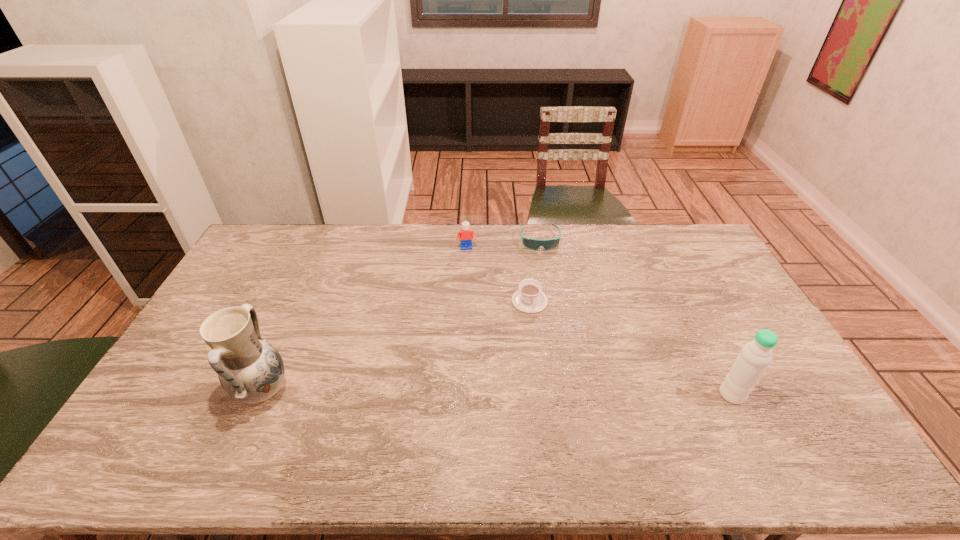
This screenshot has width=960, height=540. I want to click on pottery that is at the near edge, so click(250, 370).

Identify the location of water bottle that is at the near edge. (751, 363).

In the image, there is a desktop. What are the coordinates of `vacant area at the far edge` in the screenshot? It's located at (344, 256).

The height and width of the screenshot is (540, 960). In the image, there is a desktop. Identify the location of free space at the near edge. (263, 427).

You are a GUI agent. You are given a task and a screenshot of the screen. Output one action in this format:
    pyautogui.click(x=<x>, y=<y>)
    Task: Click on the free space at the left edge of the desktop
    Image resolution: width=960 pixels, height=540 pixels.
    Given the screenshot: What is the action you would take?
    pyautogui.click(x=262, y=285)

Find the location of a particular element. Image resolution: width=960 pixels, height=540 pixels. free point at the right edge is located at coordinates pyautogui.click(x=723, y=272).

The width and height of the screenshot is (960, 540). I want to click on free location at the far left corner of the desktop, so click(276, 226).

Find the location of a particular element. The height and width of the screenshot is (540, 960). free space at the far right corner of the desktop is located at coordinates (718, 261).

At what (x,y) coordinates should I click in order to perform the action: click on free space that is in between the third farthest object and the Lego. Please return your answer as a coordinate pair (x, y). The width and height of the screenshot is (960, 540). Looking at the image, I should click on (498, 274).

Locate an element on the screen. This screenshot has width=960, height=540. vacant region between the sunglasses and the third tallest object is located at coordinates (503, 244).